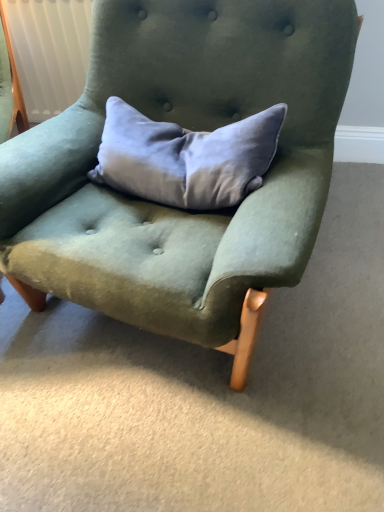
What do you see at coordinates (189, 128) in the screenshot?
I see `velvet green armchair at center` at bounding box center [189, 128].

In order to face velvet green armchair at center, should I rotate leftwards or rightwards?

Turn left approximately 2.504 degrees to face it.

Identify the location of velvet green armchair at center. This screenshot has height=512, width=384. pyautogui.click(x=189, y=128).

What is the approximate width of satin gray pillow at center?

It is 8.73 inches.

Measure the distance between point (194, 192) and camera.

Point (194, 192) and camera are 1.12 meters apart.

Describe the element at coordinates (185, 157) in the screenshot. Image resolution: width=384 pixels, height=512 pixels. I see `satin gray pillow at center` at that location.

At what (x,y) coordinates should I click in order to perform the action: click on satin gray pillow at center. Please return your answer as a coordinate pair (x, y). This screenshot has width=384, height=512. Looking at the image, I should click on (185, 157).

Find the location of `velvet green armchair at center`. velvet green armchair at center is located at coordinates (189, 128).

In the image, is satin gray pillow at center on the left side or the right side of velvet green armchair at center?

satin gray pillow at center is positioned on velvet green armchair at center's right side.

Which object is further away from the camera taking this photo, satin gray pillow at center or velvet green armchair at center?

satin gray pillow at center is further away from the camera.

Is point (137, 148) positioned behind point (118, 196)?

No, it is in front of (118, 196).

From the image's perspective, is satin gray pillow at center above or below velvet green armchair at center?

Based on their image positions, satin gray pillow at center is located above velvet green armchair at center.

From a real-world perspective, is satin gray pillow at center beneath velvet green armchair at center?

No, from a real-world perspective, satin gray pillow at center is not under velvet green armchair at center.

Considering the sizes of satin gray pillow at center and velvet green armchair at center in the image, is satin gray pillow at center wider or thinner than velvet green armchair at center?

Clearly, satin gray pillow at center has less width compared to velvet green armchair at center.

Based on the photo, is satin gray pillow at center shorter than velvet green armchair at center?

Yes.

Who is bigger, satin gray pillow at center or velvet green armchair at center?

Bigger between the two is velvet green armchair at center.

Is satin gray pillow at center spatially inside velvet green armchair at center, or outside of it?

satin gray pillow at center is spatially positioned inside velvet green armchair at center.

From the picture: Is satin gray pillow at center next to velvet green armchair at center?

There is a gap between satin gray pillow at center and velvet green armchair at center.

Does satin gray pillow at center turn towards velvet green armchair at center?

Yes, satin gray pillow at center is turned towards velvet green armchair at center.

Measure the distance between satin gray pillow at center and velvet green armchair at center.

A distance of 5.82 inches exists between satin gray pillow at center and velvet green armchair at center.

This screenshot has height=512, width=384. I want to click on pillow lying on the right of velvet green armchair at center, so click(185, 157).

Is velvet green armchair at center to the right of satin gray pillow at center from the viewer's perspective?

No, velvet green armchair at center is not to the right of satin gray pillow at center.

Is velvet green armchair at center behind satin gray pillow at center?

No, velvet green armchair at center is closer to the viewer.

Which is closer to the camera, (57, 166) or (258, 149)?

Point (57, 166) is farther from the camera than point (258, 149).

From the image's perspective, which one is positioned higher, velvet green armchair at center or satin gray pillow at center?

satin gray pillow at center, from the image's perspective.

From a real-world perspective, does velvet green armchair at center stand above satin gray pillow at center?

No.

Considering the relative sizes of velvet green armchair at center and satin gray pillow at center in the image provided, is velvet green armchair at center thinner than satin gray pillow at center?

Incorrect, the width of velvet green armchair at center is not less than that of satin gray pillow at center.

Considering the relative sizes of velvet green armchair at center and satin gray pillow at center in the image provided, is velvet green armchair at center taller than satin gray pillow at center?

Yes.

Looking at the image, does velvet green armchair at center seem bigger or smaller compared to satin gray pillow at center?

In the image, velvet green armchair at center appears to be larger than satin gray pillow at center.

Would you say satin gray pillow at center is part of velvet green armchair at center's contents?

Yes, velvet green armchair at center is surrounding satin gray pillow at center.

Is the surface of velvet green armchair at center in direct contact with satin gray pillow at center?

No, velvet green armchair at center is not in contact with satin gray pillow at center.

Is velvet green armchair at center turned away from satin gray pillow at center?

Yes, velvet green armchair at center's orientation is away from satin gray pillow at center.

Based on the photo, how different are the orientations of velvet green armchair at center and satin gray pillow at center in degrees?

1.74 degrees.

How distant is velvet green armchair at center from satin gray pillow at center?

5.82 inches.

Image resolution: width=384 pixels, height=512 pixels. I want to click on chair to the left of satin gray pillow at center, so click(x=189, y=128).

Locate an element on the screen. chair lying below the satin gray pillow at center (from the image's perspective) is located at coordinates (189, 128).

Locate an element on the screen. The width and height of the screenshot is (384, 512). pillow on the right of velvet green armchair at center is located at coordinates (185, 157).